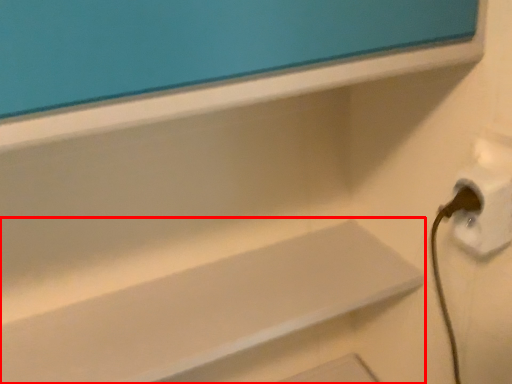
Question: From the image's perspective, what is the correct spatial positioning of shelf (annotated by the red box) in reference to electric outlet?

Choices:
 (A) above
 (B) below

Answer: (B)